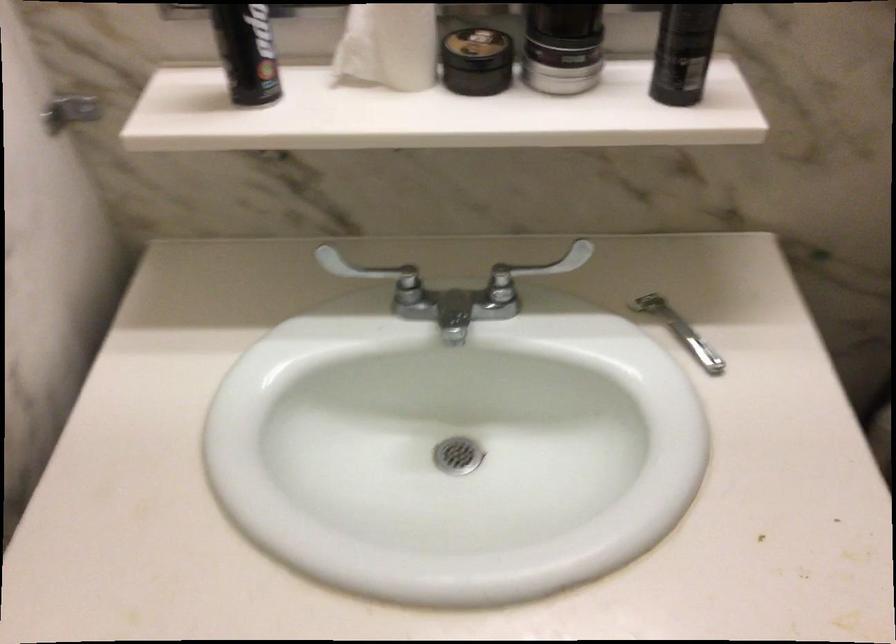
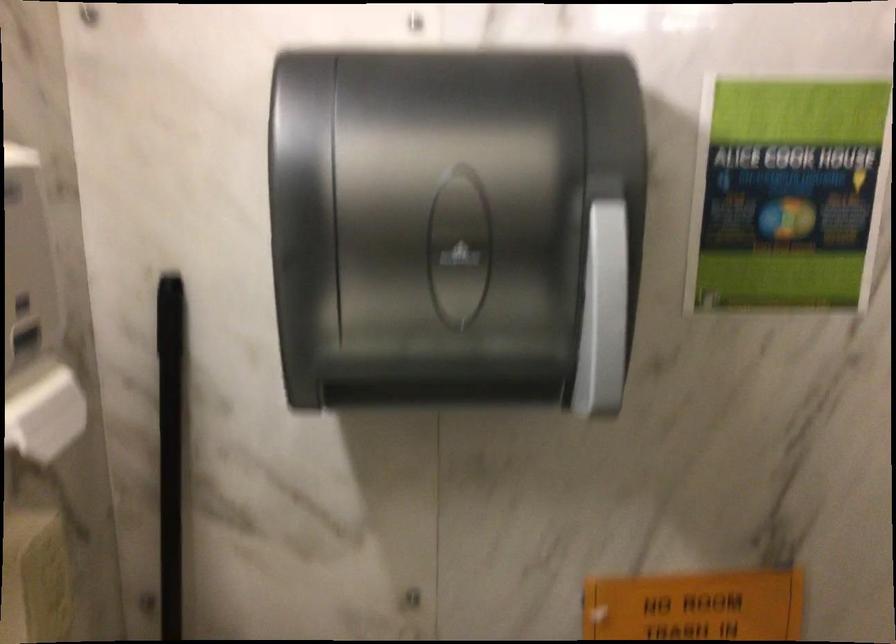
Question: Based on the continuous images, in which direction is the camera rotating? Reply with the corresponding letter.

Choices:
 (A) Left
 (B) Right
 (C) Up
 (D) Down

Answer: (B)